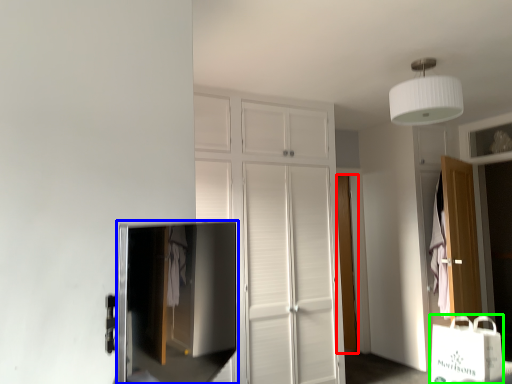
Question: Which object is positioned farthest from door (highlighted by a red box)? Select from medicine cabinet (highlighted by a blue box) and shopping bag (highlighted by a green box).

Choices:
 (A) medicine cabinet
 (B) shopping bag

Answer: (B)